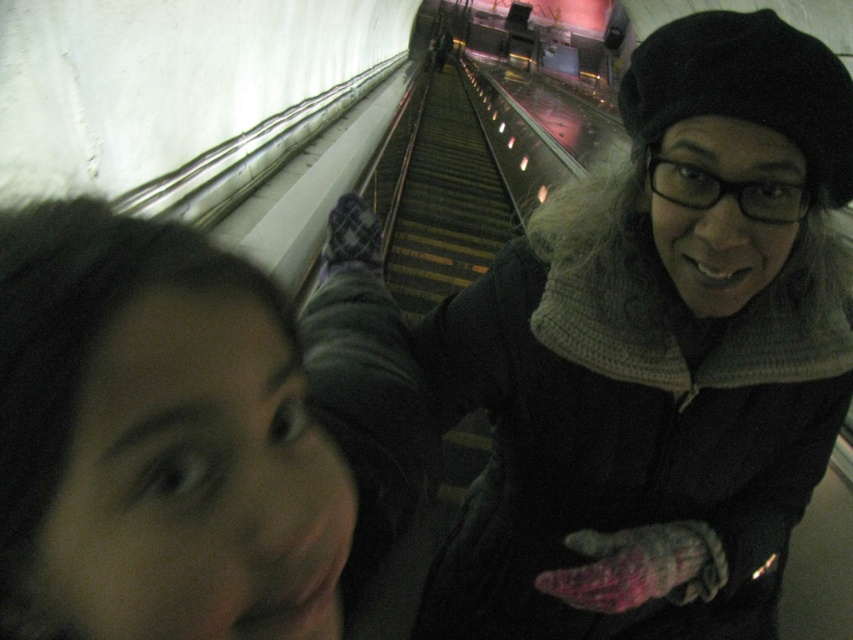
Question: Does knitted gray scarf at upper center lie behind matte black hair at upper left?

Choices:
 (A) yes
 (B) no

Answer: (A)

Question: Does knitted gray scarf at upper center have a lesser width compared to matte black hair at upper left?

Choices:
 (A) yes
 (B) no

Answer: (B)

Question: Does knitted gray scarf at upper center appear over matte black hair at upper left?

Choices:
 (A) yes
 (B) no

Answer: (B)

Question: Which point is farther from the camera taking this photo?

Choices:
 (A) (647, 83)
 (B) (199, 369)

Answer: (A)

Question: Which of the following is the farthest from the observer?

Choices:
 (A) (654, 326)
 (B) (234, 401)

Answer: (A)